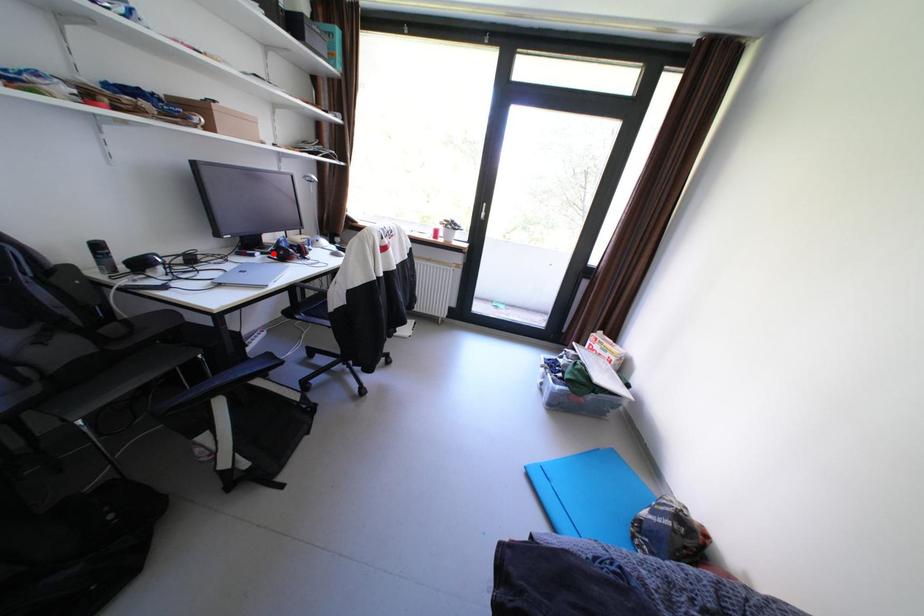
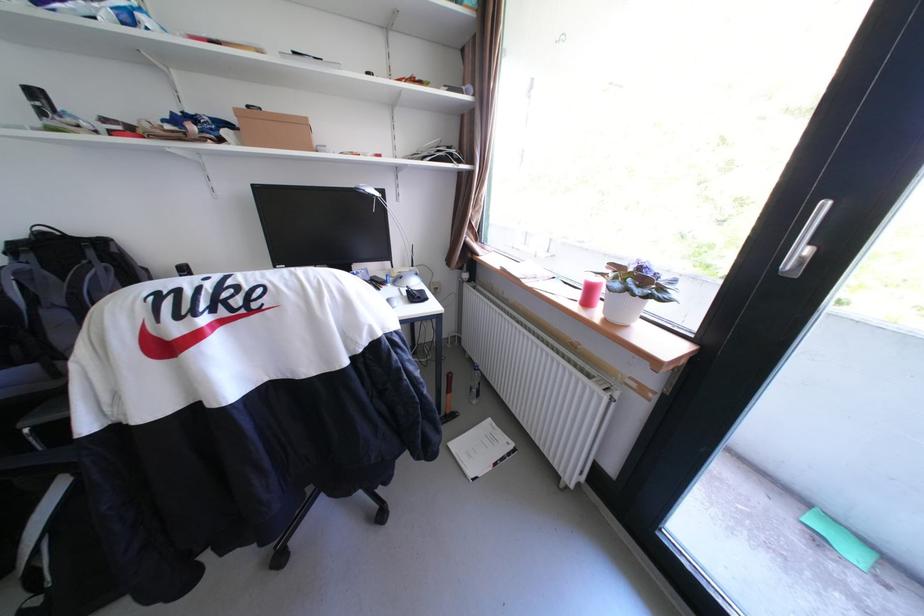
Question: I am providing you with two images of the same scene from different viewpoints. A red point is marked on the first image. Can you still see the location of the red point in image 2?

Choices:
 (A) Yes
 (B) No

Answer: (B)